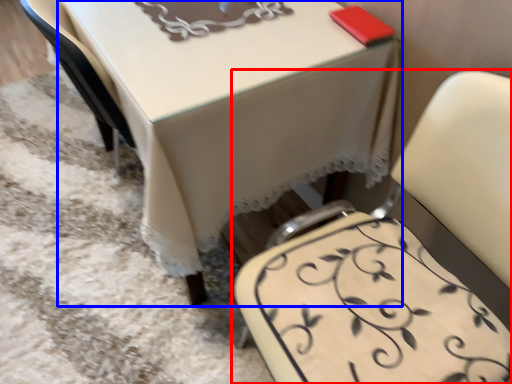
Question: Which point is closer to the camera, chair (highlighted by a red box) or table (highlighted by a blue box)?

Choices:
 (A) chair
 (B) table

Answer: (A)